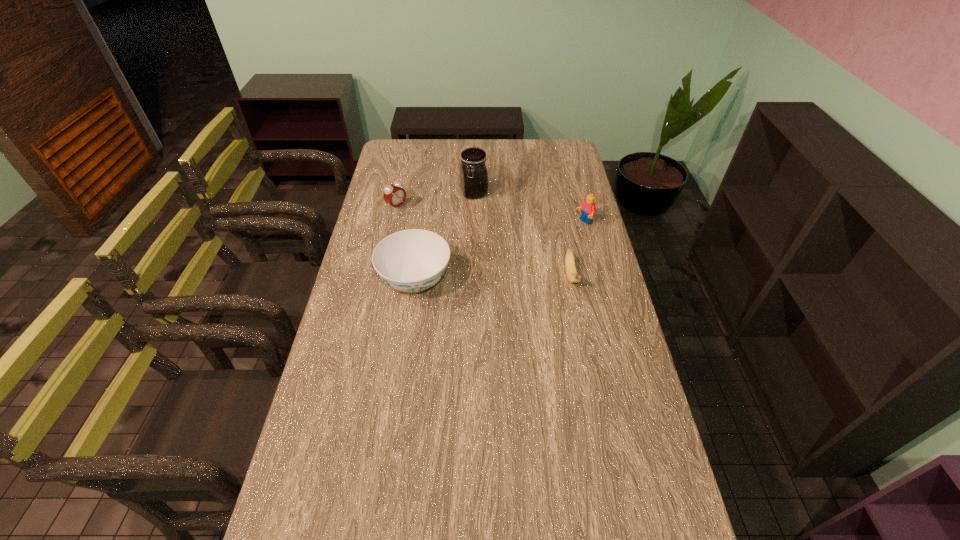
I want to click on chinaware, so click(x=413, y=260).

The image size is (960, 540). In order to click on the shortest object in this screenshot , I will do `click(572, 275)`.

At what (x,y) coordinates should I click in order to perform the action: click on the fourth object from left to right. Please return your answer as a coordinate pair (x, y). This screenshot has height=540, width=960. Looking at the image, I should click on (572, 275).

Find the location of `alarm clock`. alarm clock is located at coordinates (393, 194).

Where is `jar`? This screenshot has width=960, height=540. jar is located at coordinates (473, 172).

Locate an element on the screen. The image size is (960, 540). the third object from left to right is located at coordinates (473, 172).

Find the location of a particular element. Image resolution: width=960 pixels, height=540 pixels. the third nearest object is located at coordinates (588, 207).

At what (x,y) coordinates should I click in order to perform the action: click on Lego. Please return your answer as a coordinate pair (x, y). Looking at the image, I should click on (588, 207).

In order to click on vacant area located 0.380m on the front of the chinaware in this screenshot , I will do `click(396, 421)`.

The image size is (960, 540). I want to click on vacant region located at the stem of the banana, so click(x=580, y=321).